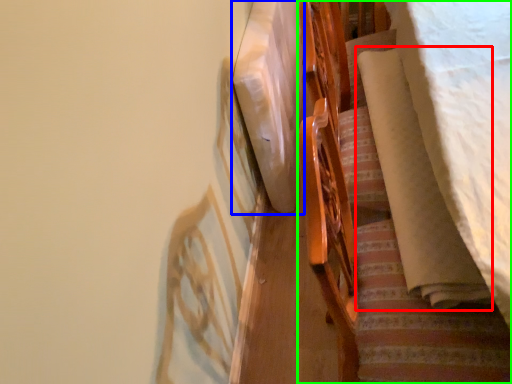
Question: Based on their relative distances, which object is nearer to blanket (highlighted by a red box)? Choose from linen (highlighted by a blue box) and furniture (highlighted by a green box).

Choices:
 (A) linen
 (B) furniture

Answer: (B)